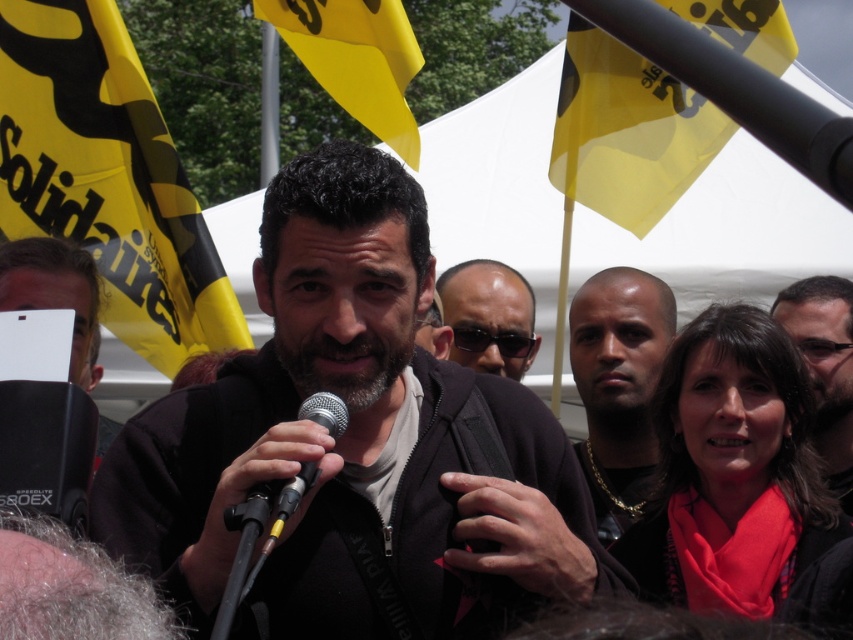
You are a photographer at the protest, and you want to capture a photo that includes both the matte black jacket at center and the matte black hair at upper right. Since you want to ensure both are in focus, you need to know which object is taller. Can you tell me which one is taller?

The matte black jacket at center is taller than matte black hair at upper right, so you should adjust your camera settings to focus on the taller matte black jacket at center first to ensure both are in focus.

You are a photographer trying to capture the speaker and the flag in your shot. The yellow fabric flag at upper left and the gold chain necklace at center are both in your view. Which object is closer to your camera lens?

The yellow fabric flag at upper left is closer to the camera lens because it is further to the viewer than the gold chain necklace at center.